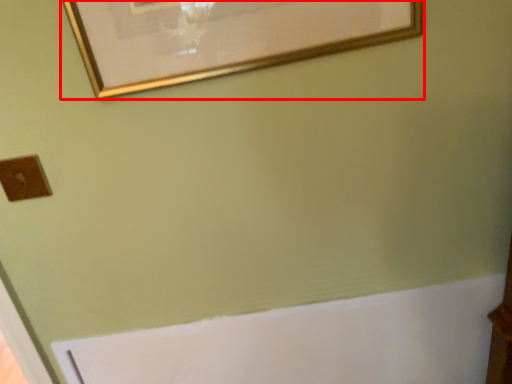
Question: From the image's perspective, considering the relative positions of picture frame (annotated by the red box) and light switch in the image provided, where is picture frame (annotated by the red box) located with respect to the staircase?

Choices:
 (A) above
 (B) below

Answer: (A)